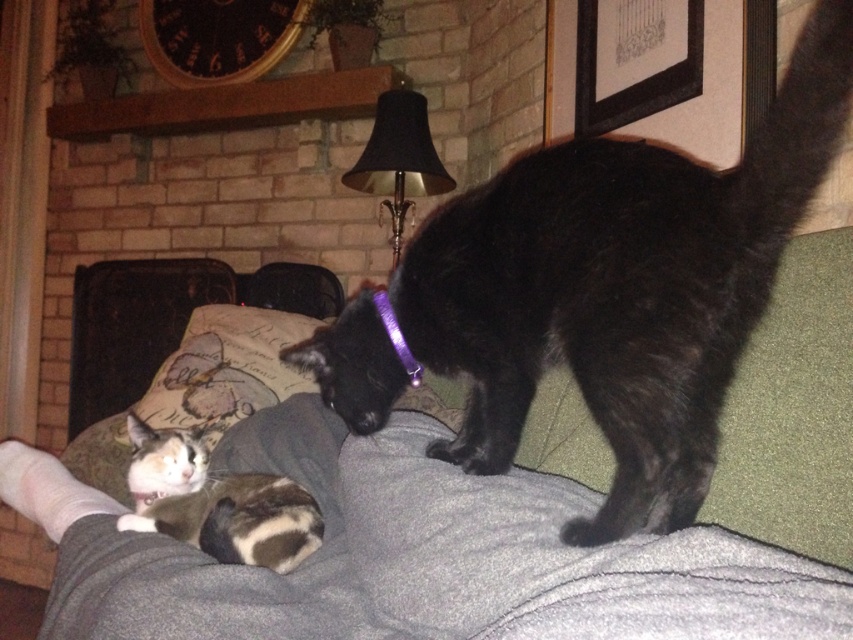
Question: Can you confirm if black fur cat at upper right is positioned above calico fur cat at lower left?

Choices:
 (A) no
 (B) yes

Answer: (B)

Question: Is calico fur cat at lower left positioned behind purple plastic collar at upper center?

Choices:
 (A) no
 (B) yes

Answer: (A)

Question: Which point appears farthest from the camera in this image?

Choices:
 (A) (363, 516)
 (B) (399, 336)

Answer: (B)

Question: Which object is positioned farthest from the purple plastic collar at upper center?

Choices:
 (A) black fur cat at upper right
 (B) green fabric couch at upper center
 (C) calico fur cat at lower left

Answer: (B)

Question: Which object appears farthest from the camera in this image?

Choices:
 (A) purple plastic collar at upper center
 (B) calico fur cat at lower left
 (C) black fur cat at upper right
 (D) green fabric couch at upper center

Answer: (A)

Question: Is green fabric couch at upper center to the right of purple plastic collar at upper center from the viewer's perspective?

Choices:
 (A) no
 (B) yes

Answer: (A)